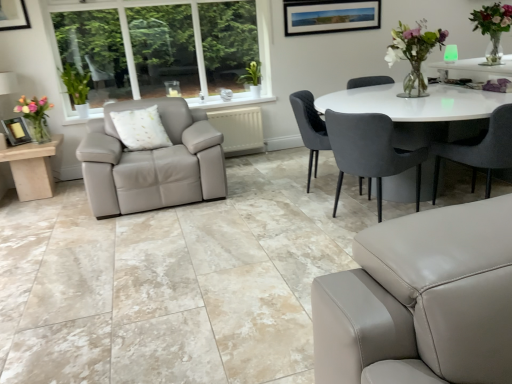
Question: From the image's perspective, is translucent glass vase at left below velvet dark gray chair at center, which ranks as the second chair in left-to-right order?

Choices:
 (A) yes
 (B) no

Answer: (B)

Question: Would you consider translucent glass vase at left to be distant from velvet dark gray chair at center, which is the second chair from right to left?

Choices:
 (A) yes
 (B) no

Answer: (A)

Question: Is translucent glass vase at left not inside velvet dark gray chair at center, which is the second chair from right to left?

Choices:
 (A) yes
 (B) no

Answer: (A)

Question: Is translucent glass vase at left smaller than velvet dark gray chair at center, which ranks as the second chair in left-to-right order?

Choices:
 (A) no
 (B) yes

Answer: (B)

Question: Is translucent glass vase at left with velvet dark gray chair at center, which ranks as the second chair in left-to-right order?

Choices:
 (A) no
 (B) yes

Answer: (A)

Question: From a real-world perspective, is translucent glass vase at left physically below velvet dark gray chair at center, which is the second chair from right to left?

Choices:
 (A) yes
 (B) no

Answer: (B)

Question: Does velvet grey chair at center, arranged as the 3th chair when viewed from the right, have a greater width compared to green leafy plant at left?

Choices:
 (A) yes
 (B) no

Answer: (A)

Question: Can you confirm if velvet grey chair at center, arranged as the 3th chair when viewed from the right, is bigger than green leafy plant at left?

Choices:
 (A) no
 (B) yes

Answer: (B)

Question: Is velvet grey chair at center, which is the first chair in left-to-right order, shorter than green leafy plant at left?

Choices:
 (A) no
 (B) yes

Answer: (A)

Question: Can you confirm if velvet grey chair at center, arranged as the 3th chair when viewed from the right, is positioned to the left of green leafy plant at left?

Choices:
 (A) yes
 (B) no

Answer: (B)

Question: Is velvet grey chair at center, which is the first chair in left-to-right order, oriented away from green leafy plant at left?

Choices:
 (A) no
 (B) yes

Answer: (B)

Question: From a real-world perspective, is velvet grey chair at center, arranged as the 3th chair when viewed from the right, on top of green leafy plant at left?

Choices:
 (A) yes
 (B) no

Answer: (B)

Question: Is green leafy plant at left to the left of matte black picture frame at lower left from the viewer's perspective?

Choices:
 (A) no
 (B) yes

Answer: (A)